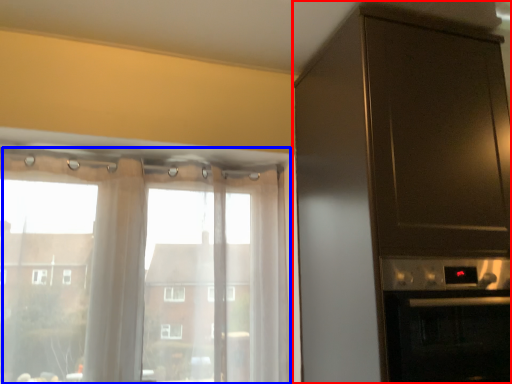
Question: Among these objects, which one is nearest to the camera, cabinetry (highlighted by a red box) or window (highlighted by a blue box)?

Choices:
 (A) cabinetry
 (B) window

Answer: (A)